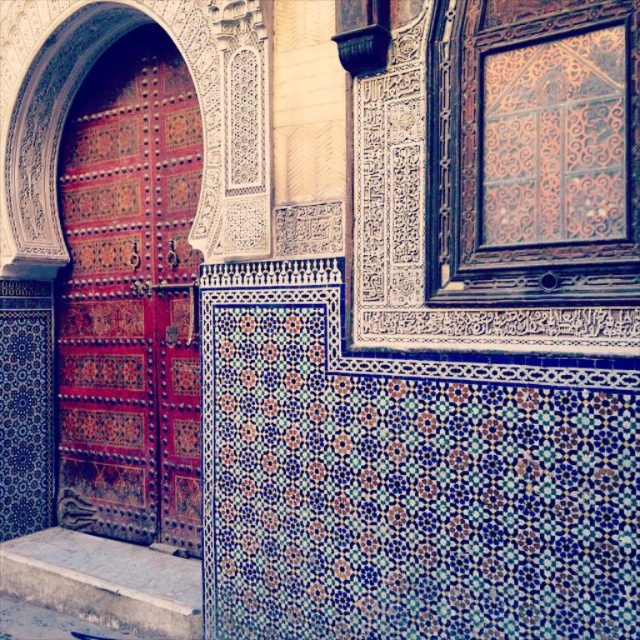
You are standing in front of the ornate architectural detail. Which object is positioned to the left of the other between the polished wood door at left and the smooth stone step at lower left?

The polished wood door at left is positioned to the left of the smooth stone step at lower left according to the description.

You are an architect examining the building details. You need to determine which object occupies more space in the image. Which is larger in size between the polished wood door at left and the smooth stone step at lower left?

The polished wood door at left is bigger than the smooth stone step at lower left, so the polished wood door at left occupies more space in the image.